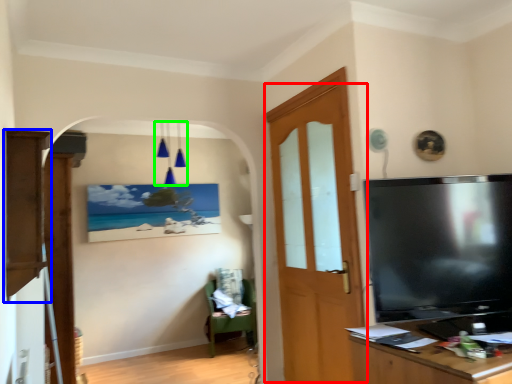
Question: Estimate the real-world distances between objects in this image. Which object is farther from door (highlighted by a red box), cabinetry (highlighted by a blue box) or light fixture (highlighted by a green box)?

Choices:
 (A) cabinetry
 (B) light fixture

Answer: (B)